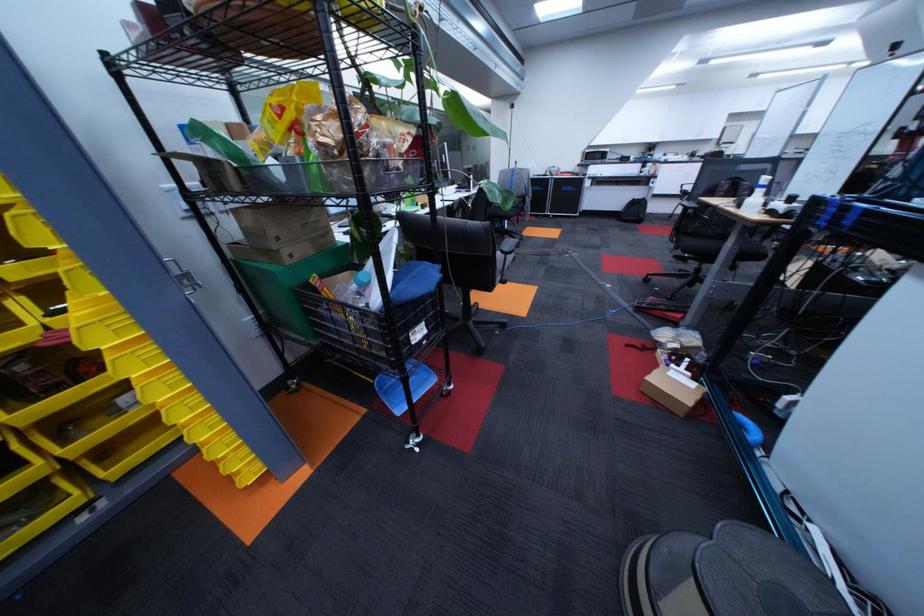
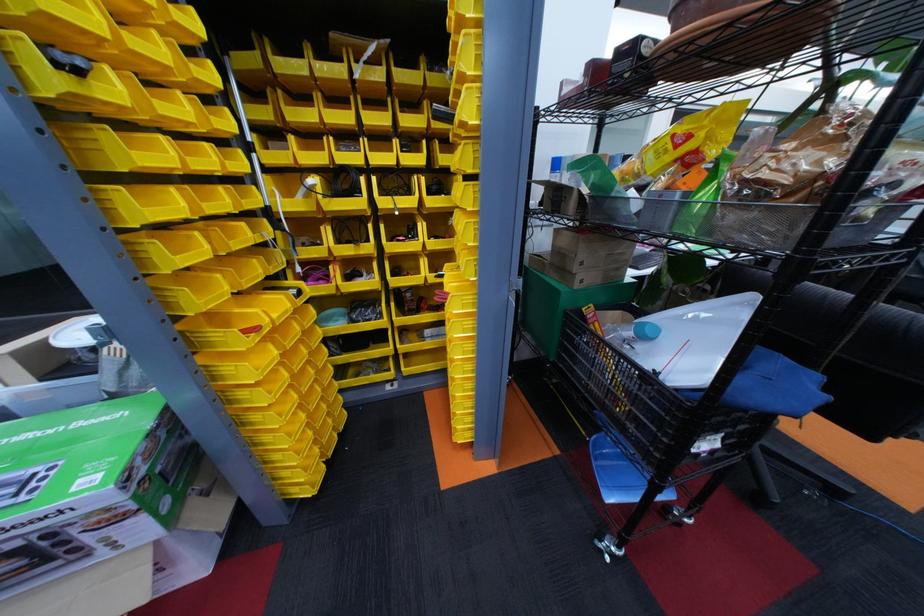
In the second image, find the point that corresponds to the point at 301,262 in the first image.

(590, 286)